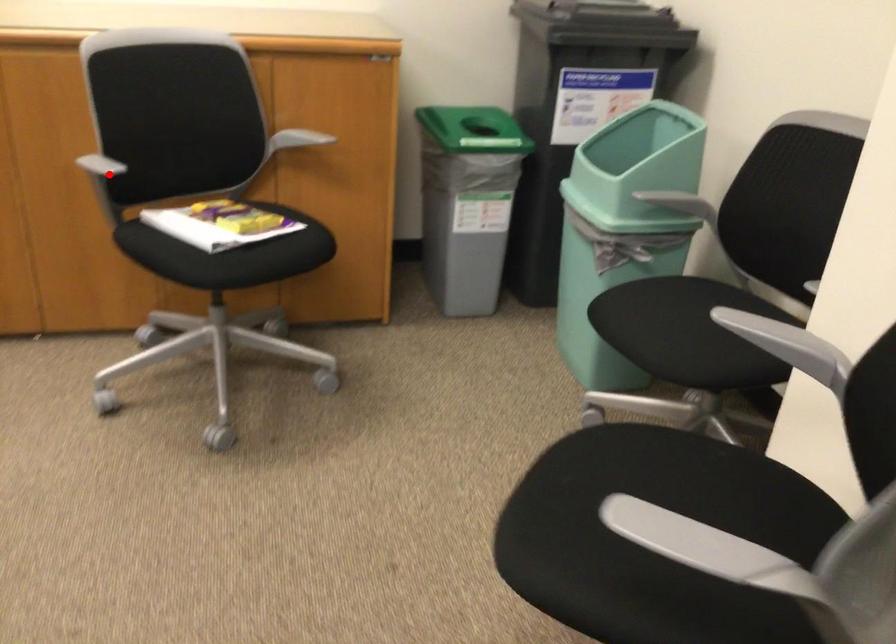
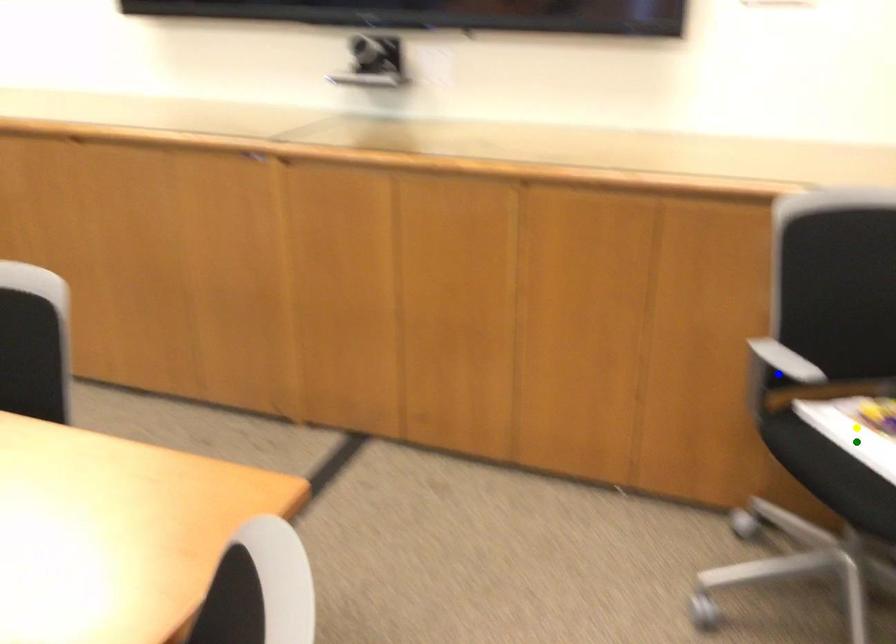
Question: I am providing you with two images of the same scene from different viewpoints. A red point is marked on the first image. You are given multiple points on the second image. In image 2, which mark is for the same physical point as the one in image 1?

Choices:
 (A) yellow point
 (B) green point
 (C) blue point

Answer: (C)